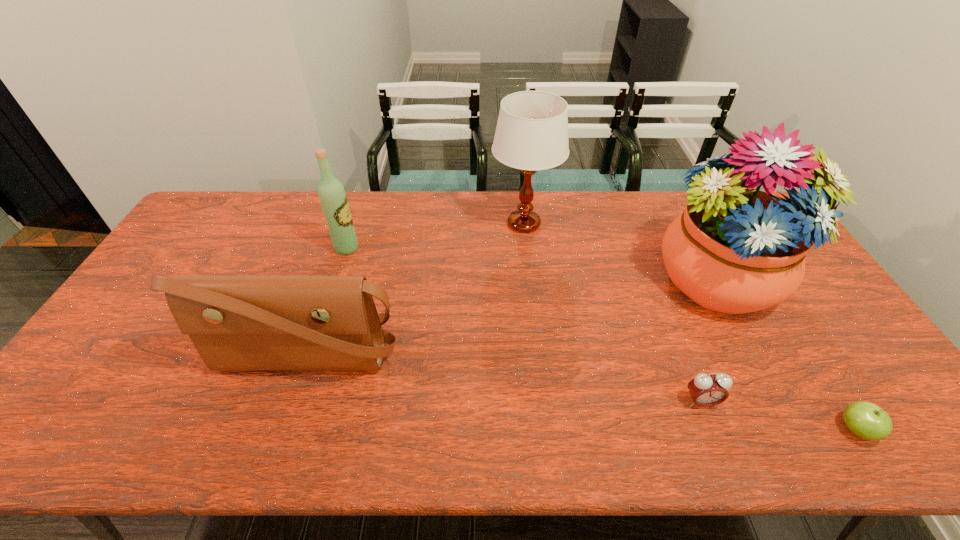
I want to click on blank space located 0.350m on the front-facing side of the wine bottle, so click(467, 248).

Where is `free point located on the front flap of the satchel`? The width and height of the screenshot is (960, 540). free point located on the front flap of the satchel is located at coordinates (284, 423).

Find the location of a particular element. The width and height of the screenshot is (960, 540). free point located on the clock face of the alarm clock is located at coordinates (718, 447).

You are a GUI agent. You are given a task and a screenshot of the screen. Output one action in this format:
    pyautogui.click(x=<x>, y=<y>)
    Task: Click on the vacant space situated 0.300m on the left of the apple
    The height and width of the screenshot is (540, 960).
    Given the screenshot: What is the action you would take?
    pyautogui.click(x=705, y=430)

Identify the location of object that is at the far edge. This screenshot has height=540, width=960. (532, 130).

Identify the location of object at the near edge. (866, 420).

Locate an element on the screen. flower arrangement that is at the right edge is located at coordinates (734, 249).

Image resolution: width=960 pixels, height=540 pixels. I want to click on apple at the right edge, so click(866, 420).

In order to click on object present at the near right corner in this screenshot , I will do `click(866, 420)`.

You are a GUI agent. You are given a task and a screenshot of the screen. Output one action in this format:
    pyautogui.click(x=<x>, y=<y>)
    Task: Click on the vacant space at the far edge
    The image size is (960, 540).
    Given the screenshot: What is the action you would take?
    (x=676, y=214)